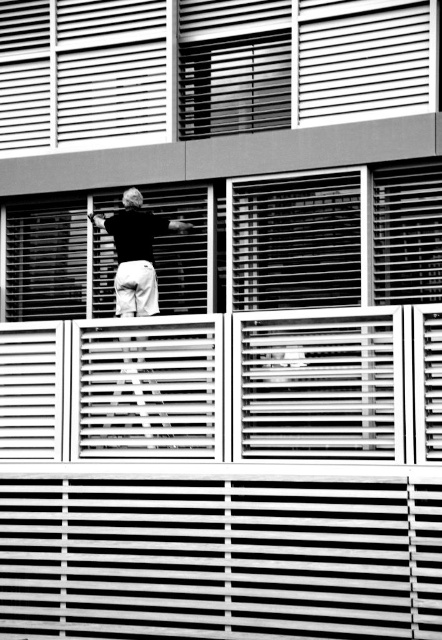
You are an architect analyzing the building structure. You observe the white slatted balcony at center and the white plastic blinds at upper center. Which of these two elements has a narrower width?

The white slatted balcony at center is thinner than the white plastic blinds at upper center, so the white slatted balcony at center has a narrower width.